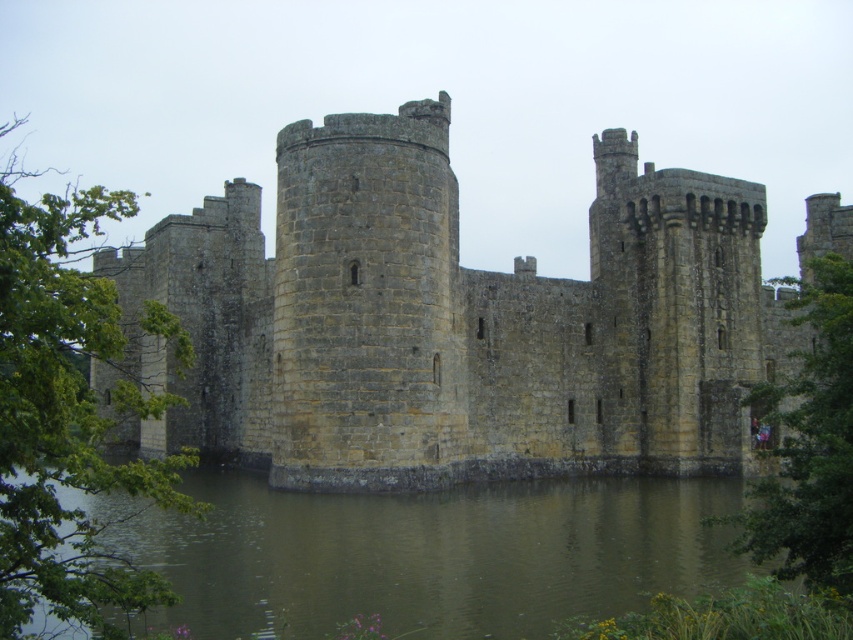
You are standing at the point marked by coordinates point (451, 321) in the image. Based on the scene description, what structure would you be directly facing?

The point (451, 321) marks stone castle at center, so you would be directly facing the stone castle at center.